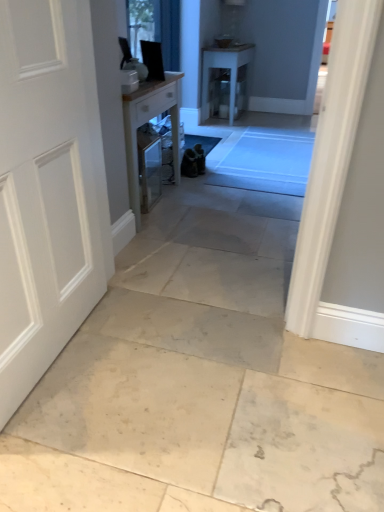
Locate an element on the screen. The image size is (384, 512). vacant space underneath white matte door at left (from a real-world perspective) is located at coordinates (53, 367).